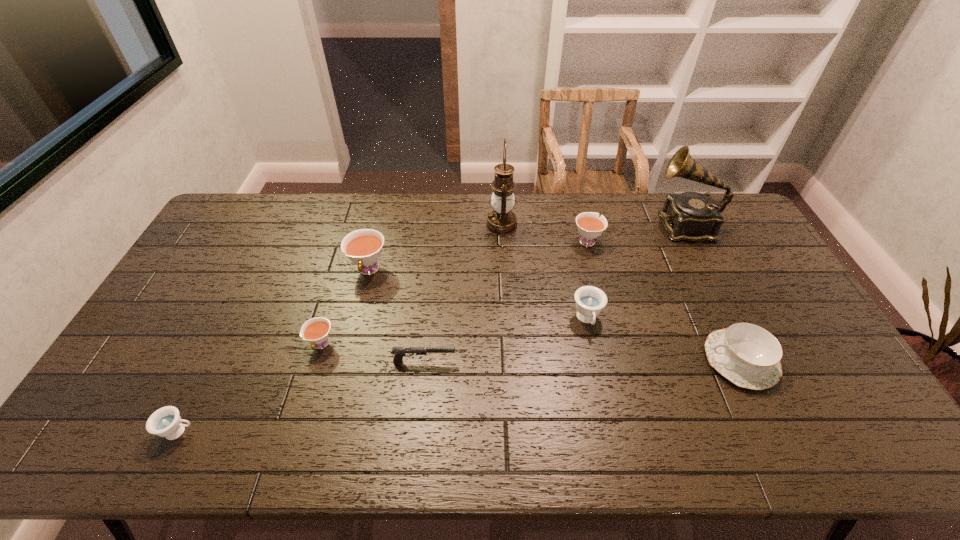
Where is `the fifth object from right to left`? The width and height of the screenshot is (960, 540). the fifth object from right to left is located at coordinates (501, 221).

Image resolution: width=960 pixels, height=540 pixels. What are the coordinates of `oil lamp` in the screenshot? It's located at (501, 221).

At what (x,y) coordinates should I click in order to perform the action: click on phonograph record. Please return your answer as a coordinate pair (x, y). The height and width of the screenshot is (540, 960). Looking at the image, I should click on (691, 216).

At what (x,y) coordinates should I click in order to perform the action: click on the tallest teacup. Please return your answer as a coordinate pair (x, y). The image size is (960, 540). Looking at the image, I should click on (363, 247).

The height and width of the screenshot is (540, 960). I want to click on the fourth farthest object, so click(x=363, y=247).

You are a GUI agent. You are given a task and a screenshot of the screen. Output one action in this format:
    pyautogui.click(x=<x>, y=<y>)
    Task: Click on the second smallest white teacup
    
    Given the screenshot: What is the action you would take?
    pyautogui.click(x=590, y=226)

Image resolution: width=960 pixels, height=540 pixels. I want to click on the farthest white teacup, so click(590, 226).

Find the location of `the farther blue teacup`. the farther blue teacup is located at coordinates (590, 300).

You are a GUI agent. You are given a task and a screenshot of the screen. Output one action in this format:
    pyautogui.click(x=<x>, y=<y>)
    Task: Click on the bigger blue teacup
    Image resolution: width=960 pixels, height=540 pixels.
    Given the screenshot: What is the action you would take?
    pyautogui.click(x=590, y=300)

Image resolution: width=960 pixels, height=540 pixels. In order to click on blue chinaware in this screenshot , I will do `click(748, 355)`.